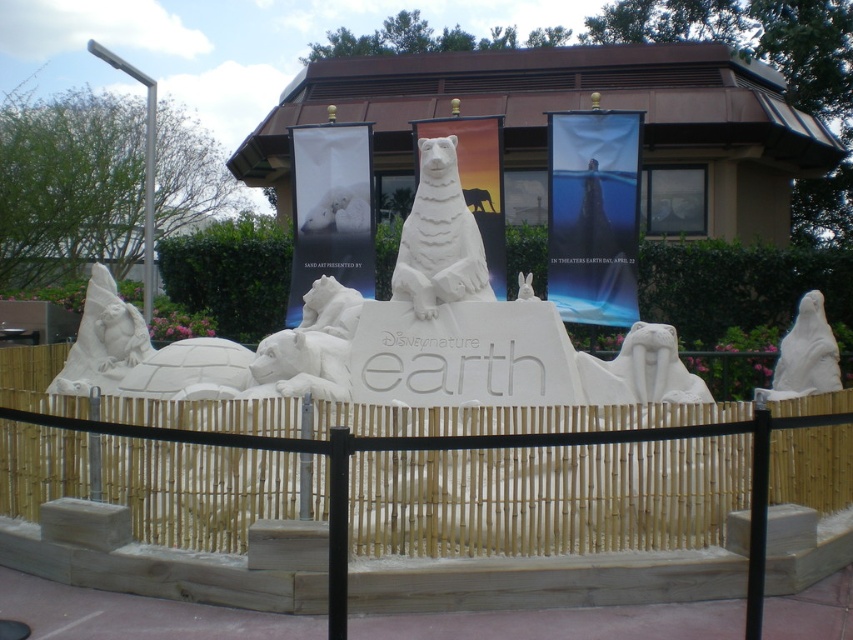
Question: Does white stone turtle at left have a larger size compared to white stone walrus at center?

Choices:
 (A) yes
 (B) no

Answer: (A)

Question: Which point is farther from the camera taking this photo?

Choices:
 (A) (637, 381)
 (B) (74, 360)
 (C) (421, 301)
 (D) (805, 298)

Answer: (B)

Question: Is white sand bear at center closer to camera compared to white stone walrus at center?

Choices:
 (A) no
 (B) yes

Answer: (A)

Question: Is white sand bear at center to the left of white stone walrus at center from the viewer's perspective?

Choices:
 (A) no
 (B) yes

Answer: (B)

Question: Among these points, which one is nearest to the camera?

Choices:
 (A) (480, 474)
 (B) (479, 260)
 (C) (755, 392)

Answer: (A)

Question: Among these objects, which one is farthest from the camera?

Choices:
 (A) white stone turtle at left
 (B) bamboo fence at center

Answer: (A)